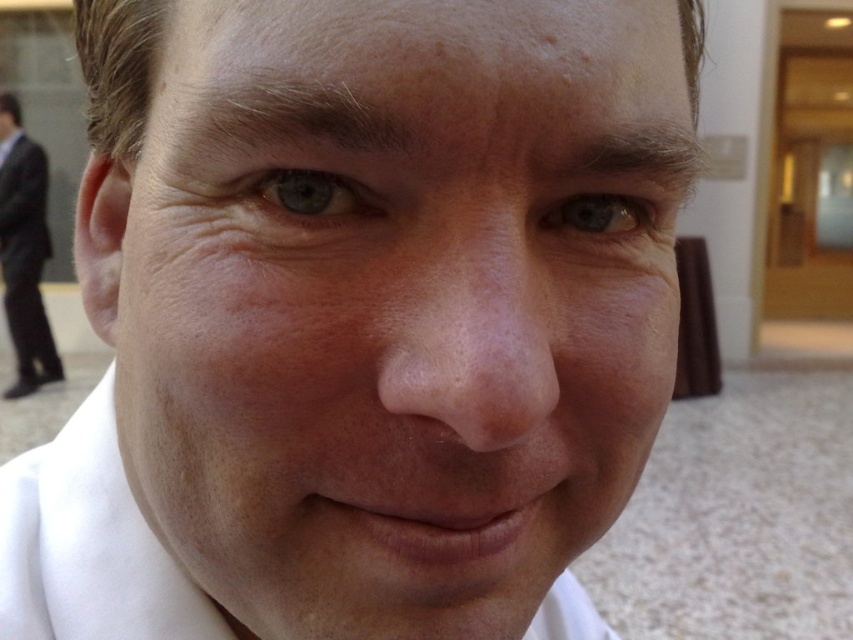
You are a photographer adjusting the focus of your camera. You notice the white matte dress shirt at center and the blue matte eye at upper left are both in the frame. Which object should you focus on if you want to prioritize the larger subject?

The white matte dress shirt at center is bigger than the blue matte eye at upper left, so you should focus on the white matte dress shirt at center to prioritize the larger subject.

You are a photographer adjusting your camera settings to capture a portrait. You notice the smooth skin face at center and the blue matte eye at upper left in your viewfinder. Which object is located more to the left in the frame?

The smooth skin face at center is positioned more to the left than the blue matte eye at upper left.

You are a photographer adjusting the focus of your camera. The subject has a smooth skin face at center and a blue matte eye at upper left. You need to ensure both are in focus. Given the current focus distance, which object should you adjust the focus towards to bring both into clarity?

The smooth skin face at center is closer to the camera than the blue matte eye at upper left. To bring both into focus, adjust the focus towards the smooth skin face at center since it is closer and requires a different focal plane.